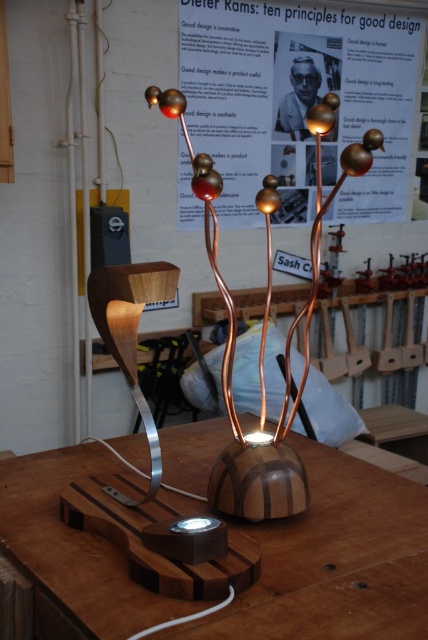
Question: Which object is positioned closest to the wooden table lamp at center?

Choices:
 (A) metallic poster at upper center
 (B) wooden table at center

Answer: (B)

Question: Is wooden table at center behind wooden table lamp at center?

Choices:
 (A) yes
 (B) no

Answer: (B)

Question: Which of these objects is positioned closest to the metallic poster at upper center?

Choices:
 (A) wooden table lamp at center
 (B) wooden table at center

Answer: (A)

Question: Can you confirm if wooden table at center is positioned above wooden table lamp at center?

Choices:
 (A) yes
 (B) no

Answer: (B)

Question: Which point appears farthest from the camera in this image?

Choices:
 (A) (410, 141)
 (B) (296, 470)
 (C) (204, 435)

Answer: (A)

Question: Is metallic poster at upper center smaller than wooden table lamp at center?

Choices:
 (A) yes
 (B) no

Answer: (B)